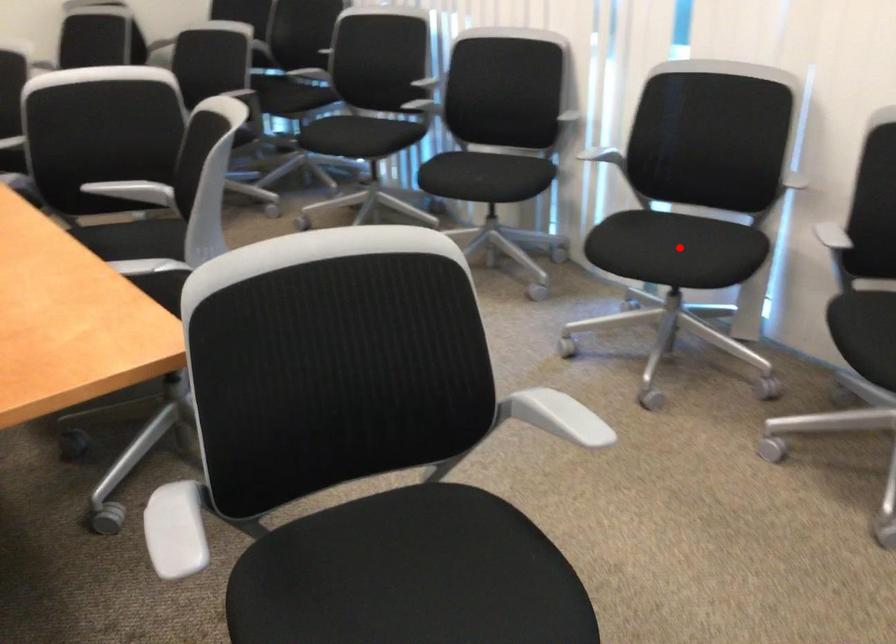
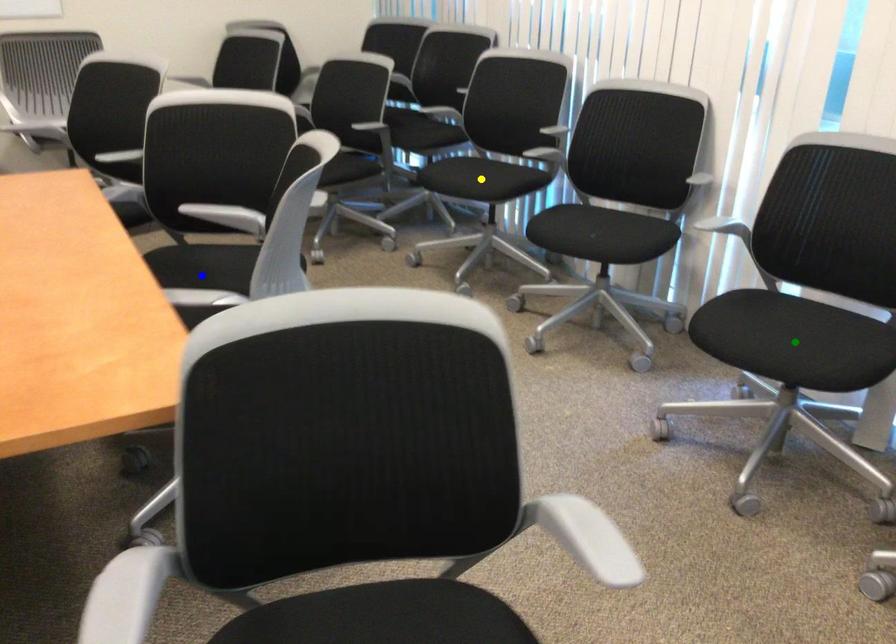
Question: I am providing you with two images of the same scene from different viewpoints. A red point is marked on the first image. You are given multiple points on the second image. Which mark in image 2 goes with the point in image 1?

Choices:
 (A) blue point
 (B) green point
 (C) yellow point

Answer: (B)